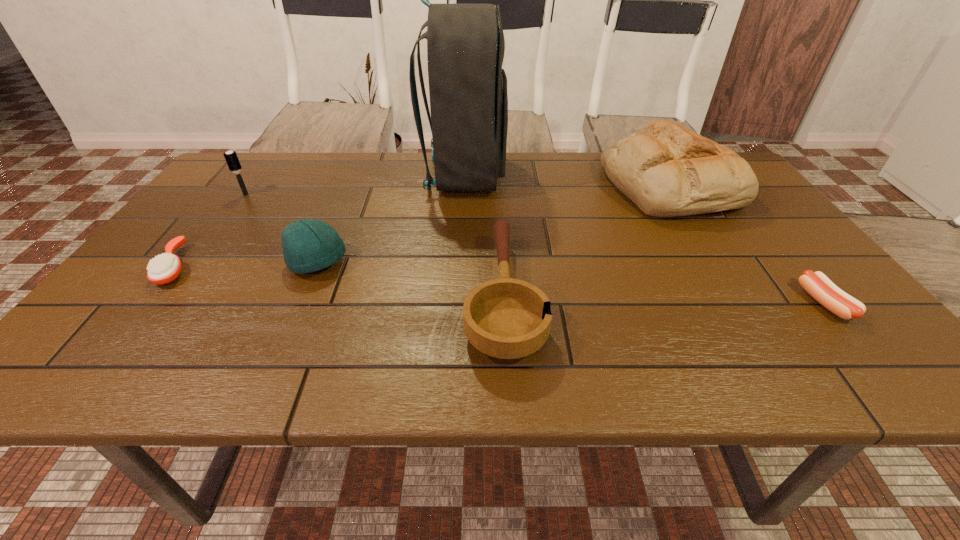
Find the location of a particular element. vacant area in the image that satisfies the following two spatial constraints: 1. on the back side of the sausage; 2. on the front-facing side of the backpack is located at coordinates (721, 175).

Identify the location of vacant point that satisfies the following two spatial constraints: 1. on the front-facing side of the backpack; 2. on the right side of the sausage. The height and width of the screenshot is (540, 960). (458, 303).

Locate an element on the screen. vacant region that satisfies the following two spatial constraints: 1. with the handle on the side of the fifth tallest object; 2. on the front-facing side of the tallest object is located at coordinates (497, 175).